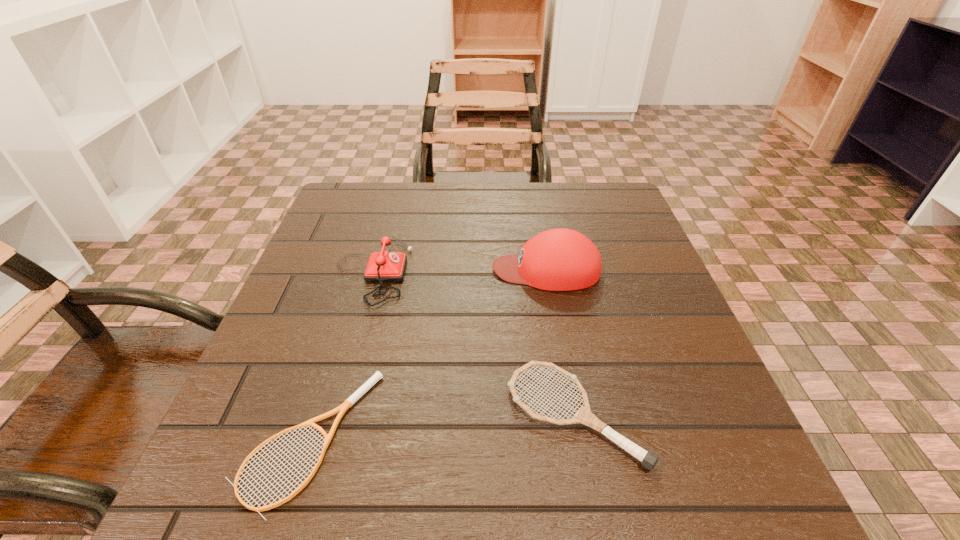
Image resolution: width=960 pixels, height=540 pixels. In order to click on vacant space that satisfies the following two spatial constraints: 1. on the back side of the taller tennis racket; 2. on the front-facing side of the tallest object in this screenshot , I will do `click(548, 269)`.

Image resolution: width=960 pixels, height=540 pixels. I want to click on vacant region that satisfies the following two spatial constraints: 1. on the dial of the second tallest object; 2. on the left side of the third tallest object, so click(x=331, y=415).

Where is `vacant area in the image that satisfies the following two spatial constraints: 1. on the dial of the telephone; 2. on the right side of the right tennis racket`? This screenshot has width=960, height=540. vacant area in the image that satisfies the following two spatial constraints: 1. on the dial of the telephone; 2. on the right side of the right tennis racket is located at coordinates (331, 415).